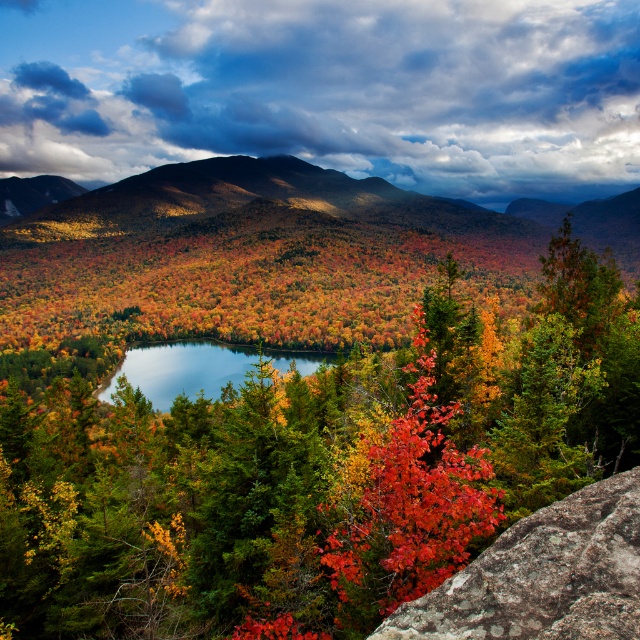
Question: Does vivid red leaves at center have a larger size compared to blue glassy lake at center?

Choices:
 (A) no
 (B) yes

Answer: (A)

Question: Which point is closer to the camera?

Choices:
 (A) autumn leaves at center
 (B) blue glassy lake at center
 (C) vivid red leaves at center
 (D) rusty rock at lower right

Answer: (D)

Question: Which point is farther to the camera?

Choices:
 (A) (364, 406)
 (B) (595, 564)
 (C) (445, 497)

Answer: (A)

Question: Is autumn leaves at center above rusty rock at lower right?

Choices:
 (A) no
 (B) yes

Answer: (B)

Question: Can you confirm if autumn leaves at center is wider than rusty rock at lower right?

Choices:
 (A) yes
 (B) no

Answer: (A)

Question: Which object is the closest to the autumn leaves at center?

Choices:
 (A) vivid red leaves at center
 (B) rusty rock at lower right
 (C) blue glassy lake at center

Answer: (A)